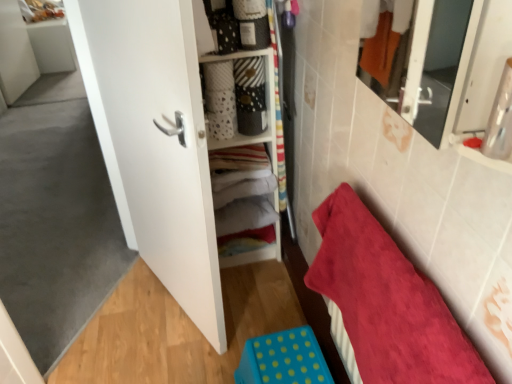
Question: Would you say white soft fabric at center is to the left or to the right of red plush towel at lower right in the picture?

Choices:
 (A) right
 (B) left

Answer: (B)

Question: Is white soft fabric at center wider or thinner than red plush towel at lower right?

Choices:
 (A) wide
 (B) thin

Answer: (A)

Question: Which object is positioned closest to the matte white cabinet at center?

Choices:
 (A) red plush towel at lower right
 (B) white matte door at center
 (C) blue polka dot plastic step stool at lower center
 (D) white soft fabric at center

Answer: (D)

Question: Which object is positioned farthest from the matte white cabinet at center?

Choices:
 (A) white matte door at center
 (B) red plush towel at lower right
 (C) white soft fabric at center
 (D) blue polka dot plastic step stool at lower center

Answer: (B)